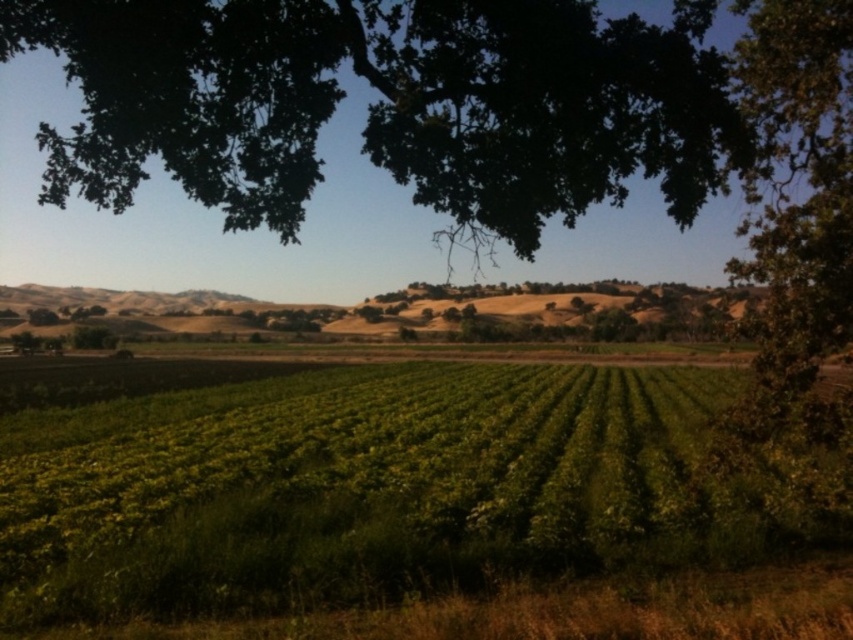
Based on the photo, can you confirm if green leafy field at center is positioned below green leafy tree at upper center?

Correct, green leafy field at center is located below green leafy tree at upper center.

Does point (628, 477) lie in front of point (142, 157)?

No, (628, 477) is behind (142, 157).

I want to click on green leafy field at center, so click(x=405, y=509).

Describe the element at coordinates (405, 509) in the screenshot. Image resolution: width=853 pixels, height=640 pixels. I see `green leafy field at center` at that location.

Does point (344, 380) come behind point (817, 435)?

Yes, point (344, 380) is behind point (817, 435).

Image resolution: width=853 pixels, height=640 pixels. In order to click on green leafy field at center in this screenshot , I will do (x=405, y=509).

Does point (509, 236) lie behind point (790, 221)?

No, it is not.

Is green leafy tree at upper center shorter than green leafy tree at upper right?

In fact, green leafy tree at upper center may be taller than green leafy tree at upper right.

Who is more forward, (126,92) or (746,44)?

Point (126,92) is more forward.

Find the location of a particular element. Image resolution: width=853 pixels, height=640 pixels. green leafy tree at upper center is located at coordinates (378, 104).